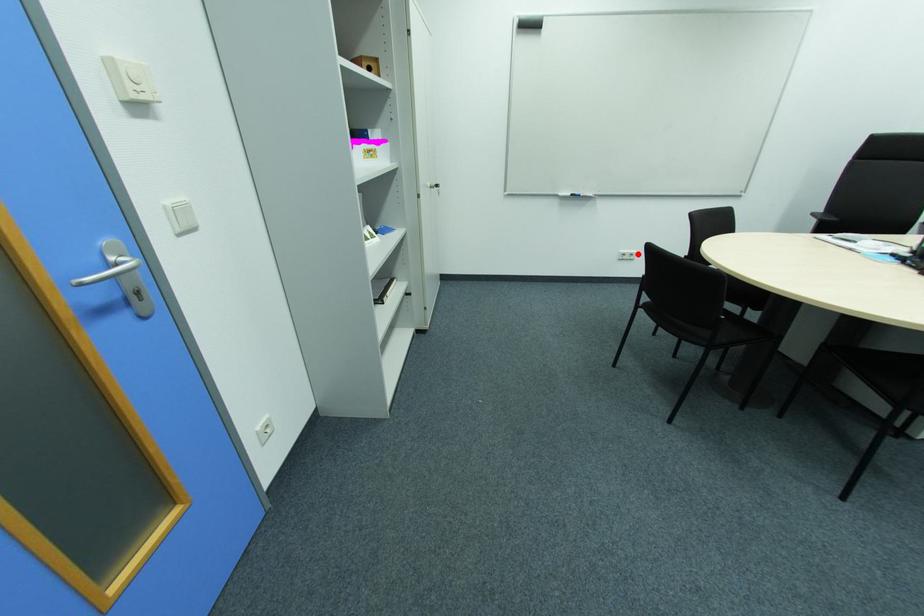
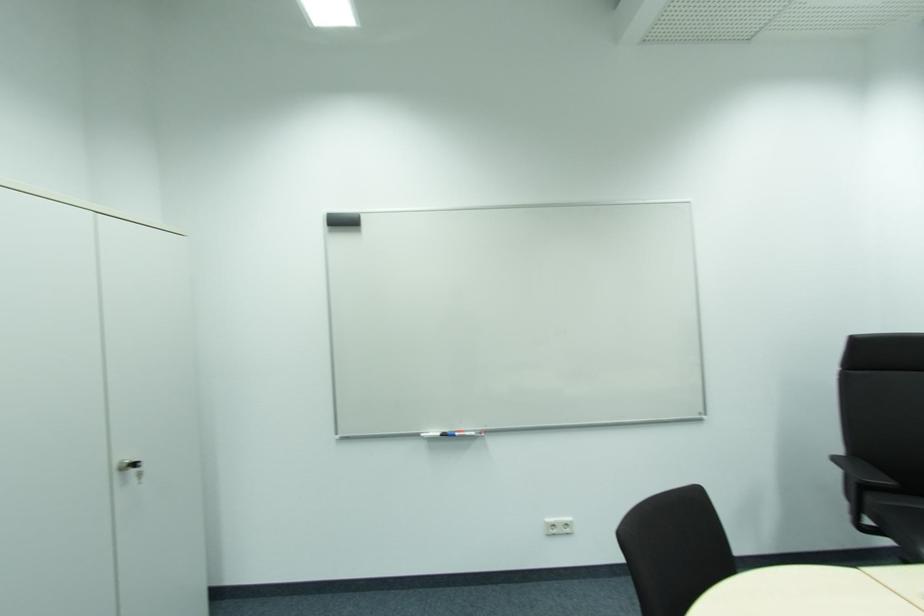
Where in the second image is the point corresponding to the highlighted location from the first image?

(572, 524)